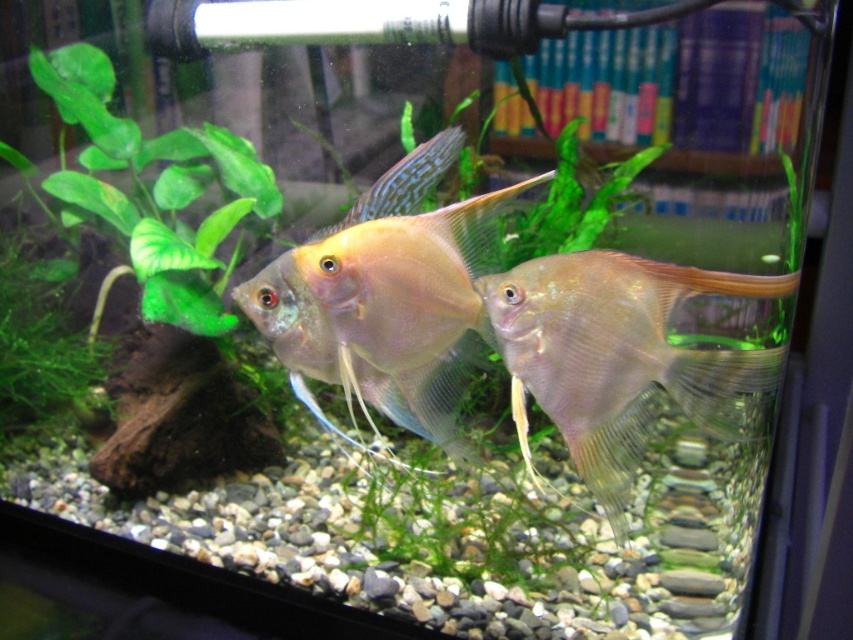
You are standing in front of the fish tank and want to touch the point at coordinates point (650, 268). If your hand is 0.5 meters away from the tank, will you be able to reach the point?

The point (650, 268) is 1.02 meters away from the viewer. Since your hand is only 0.5 meters away from the tank, you cannot reach the point as the distance required is greater than what your hand can extend.